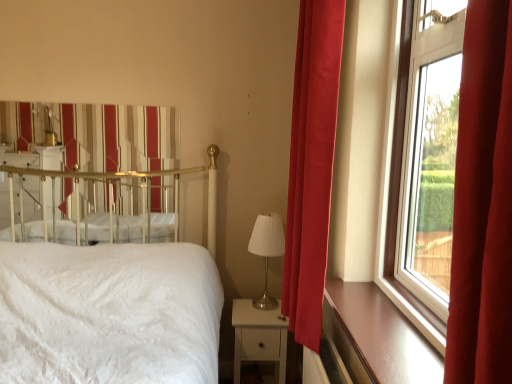
Question: From a real-world perspective, is transparent glass window at right below white textured bed at left?

Choices:
 (A) no
 (B) yes

Answer: (A)

Question: Considering the relative sizes of transparent glass window at right and white textured bed at left in the image provided, is transparent glass window at right smaller than white textured bed at left?

Choices:
 (A) yes
 (B) no

Answer: (A)

Question: Is transparent glass window at right outside of white textured bed at left?

Choices:
 (A) yes
 (B) no

Answer: (A)

Question: Can you confirm if transparent glass window at right is shorter than white textured bed at left?

Choices:
 (A) yes
 (B) no

Answer: (A)

Question: Considering the relative positions of transparent glass window at right and white textured bed at left in the image provided, is transparent glass window at right to the left of white textured bed at left from the viewer's perspective?

Choices:
 (A) no
 (B) yes

Answer: (A)

Question: Is transparent glass window at right further to the viewer compared to white textured bed at left?

Choices:
 (A) no
 (B) yes

Answer: (B)

Question: Does satin red curtain at right have a greater width compared to metallic gold canopy bed at upper left?

Choices:
 (A) yes
 (B) no

Answer: (A)

Question: From the image's perspective, is satin red curtain at right over metallic gold canopy bed at upper left?

Choices:
 (A) yes
 (B) no

Answer: (B)

Question: Is satin red curtain at right bigger than metallic gold canopy bed at upper left?

Choices:
 (A) yes
 (B) no

Answer: (A)

Question: Is satin red curtain at right positioned in front of metallic gold canopy bed at upper left?

Choices:
 (A) no
 (B) yes

Answer: (B)

Question: Is metallic gold canopy bed at upper left inside satin red curtain at right?

Choices:
 (A) yes
 (B) no

Answer: (B)

Question: From a real-world perspective, does satin red curtain at right sit lower than metallic gold canopy bed at upper left?

Choices:
 (A) no
 (B) yes

Answer: (A)

Question: Does metallic gold canopy bed at upper left have a larger size compared to brown wood at right?

Choices:
 (A) no
 (B) yes

Answer: (B)